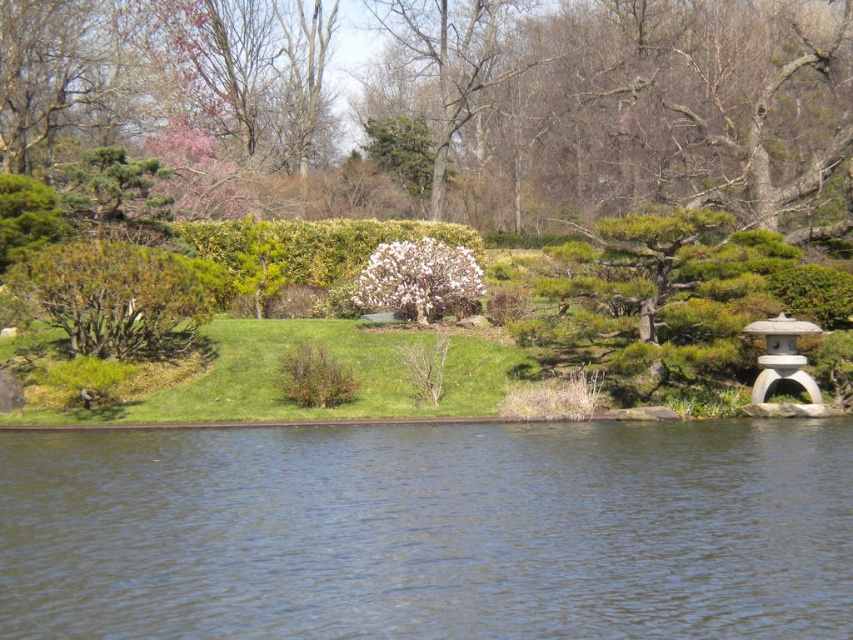
The width and height of the screenshot is (853, 640). What do you see at coordinates (450, 106) in the screenshot?
I see `green leafy bush at upper center` at bounding box center [450, 106].

Is green leafy bush at upper center positioned behind white fluffy bush at center?

Yes, it is behind white fluffy bush at center.

Who is more forward, (809, 8) or (369, 269)?

Point (369, 269)

You are a GUI agent. You are given a task and a screenshot of the screen. Output one action in this format:
    pyautogui.click(x=<x>, y=<y>)
    Task: Click on the green leafy bush at upper center
    
    Given the screenshot: What is the action you would take?
    pyautogui.click(x=450, y=106)

Measure the distance from green leafy bush at upper center to green textured hedge at center.

green leafy bush at upper center and green textured hedge at center are 19.88 meters apart from each other.

Does green leafy bush at upper center have a lesser height compared to green textured hedge at center?

No, green leafy bush at upper center is not shorter than green textured hedge at center.

The height and width of the screenshot is (640, 853). Describe the element at coordinates (450, 106) in the screenshot. I see `green leafy bush at upper center` at that location.

Where is `green leafy bush at upper center`? The height and width of the screenshot is (640, 853). green leafy bush at upper center is located at coordinates (450, 106).

Which of these two, green leafy bush at upper center or brown textured bush at center, stands taller?

green leafy bush at upper center

Can you confirm if green leafy bush at upper center is bigger than brown textured bush at center?

Indeed, green leafy bush at upper center has a larger size compared to brown textured bush at center.

Which is in front, point (375, 68) or point (341, 365)?

Point (341, 365) is in front.

Identify the location of green leafy bush at upper center. (450, 106).